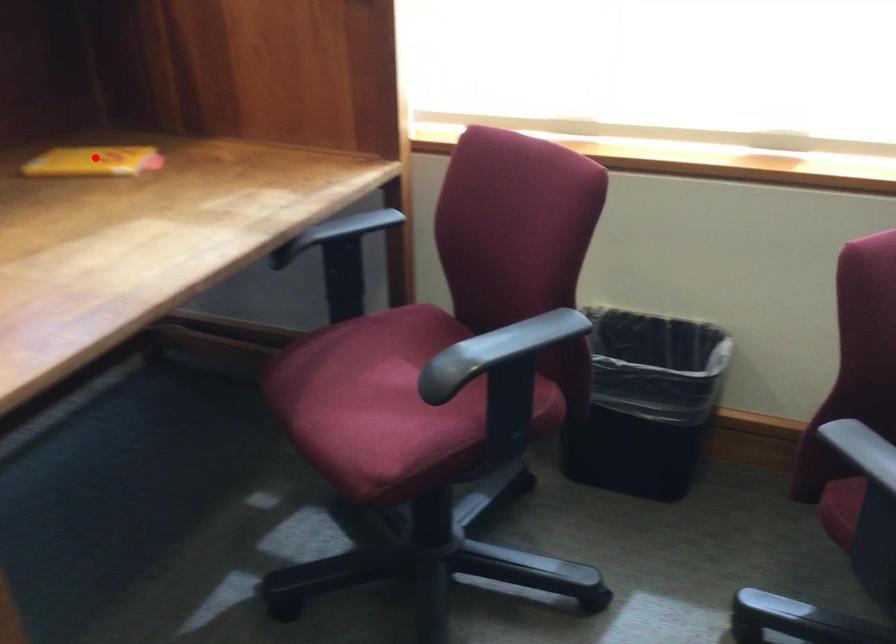
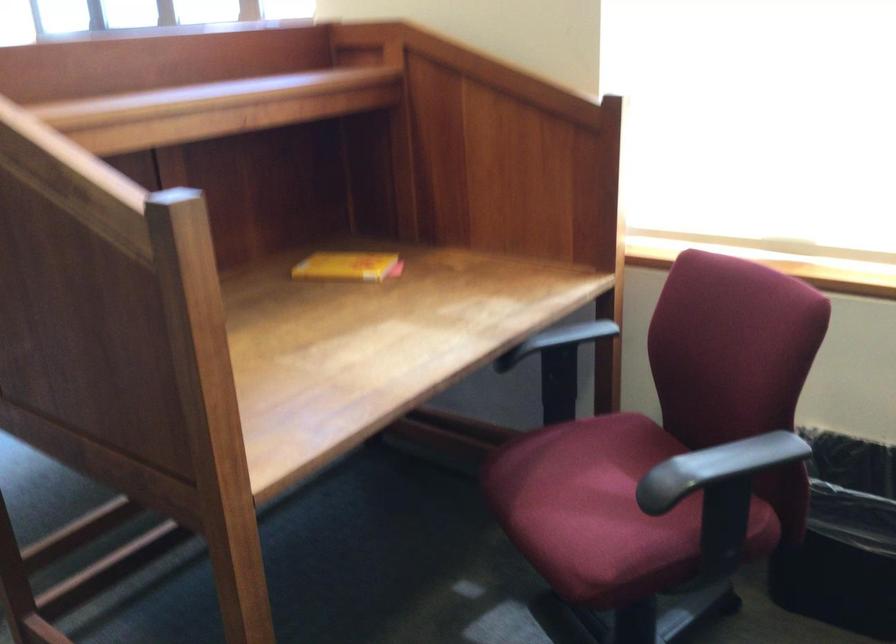
In the second image, find the point that corresponds to the highlighted location in the first image.

(348, 266)